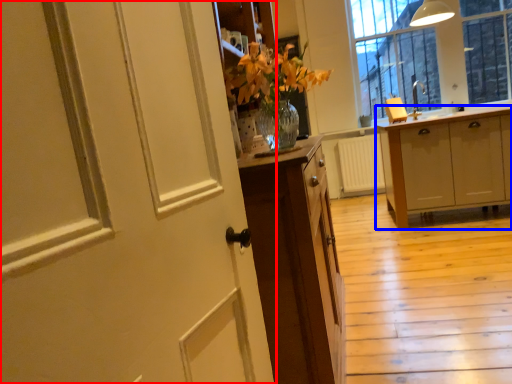
Question: Which object is further to the camera taking this photo, door (highlighted by a red box) or cabinetry (highlighted by a blue box)?

Choices:
 (A) door
 (B) cabinetry

Answer: (B)